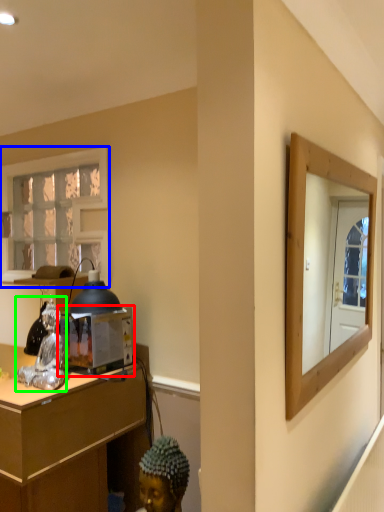
Question: Considering the real-world distances, which object is farthest from appliance (highlighted by a red box)? window (highlighted by a blue box) or figurine (highlighted by a green box)?

Choices:
 (A) window
 (B) figurine

Answer: (A)